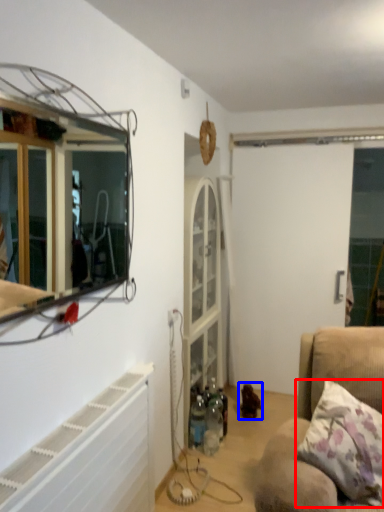
Question: Which of the following is the closest to the observer, pillow (highlighted by a red box) or toy (highlighted by a blue box)?

Choices:
 (A) pillow
 (B) toy

Answer: (A)